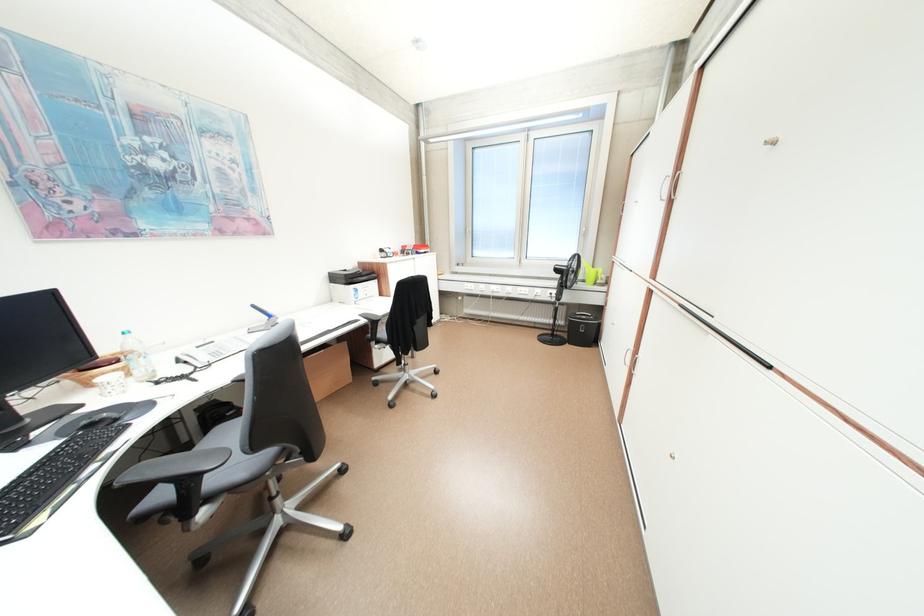
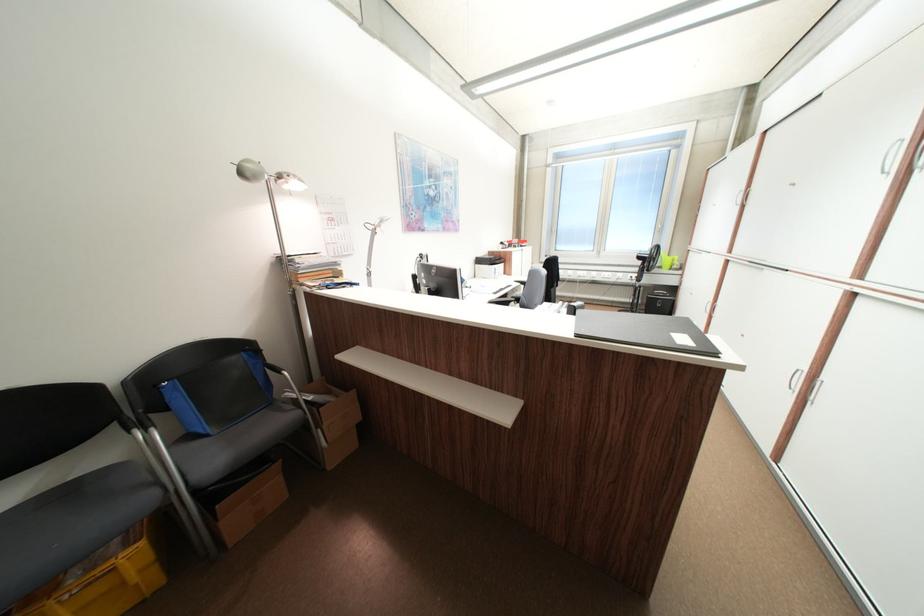
What movement of the cameraman would produce the second image?

The movement direction of the cameraman is left, backward.